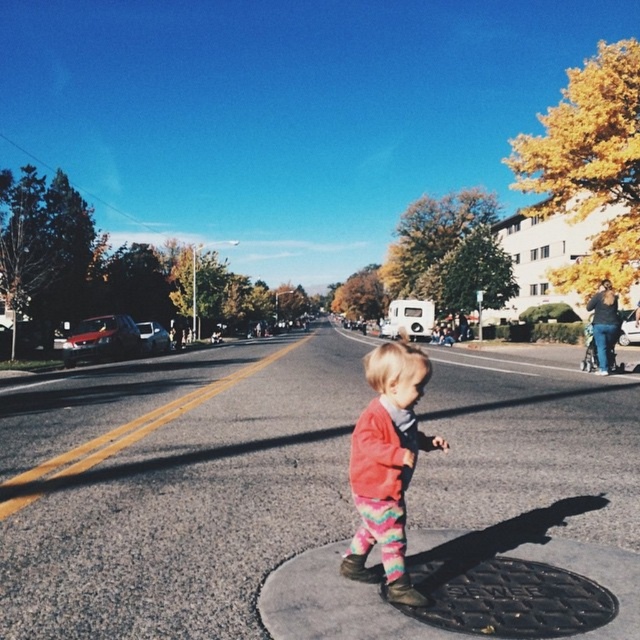
You are a pedestrian standing on the road and see the red sweater at center and the black textured manhole cover at center. Which object is closer to you?

The red sweater at center is closer because the black textured manhole cover at center is behind it.

You are a delivery person who needs to place a large package on the ground without covering the black textured manhole cover at center. The package is the same size as the red sweater at center. Will the package fit without overlapping the manhole cover?

The red sweater at center is larger in size than the black textured manhole cover at center. Since the package is the same size as the red sweater at center, it will also be larger than the manhole cover. Therefore, placing the package directly over the manhole cover would cause it to overlap, so you need to position it elsewhere to avoid covering the manhole cover.

You are standing at the point with coordinates point (x=397, y=561) and want to walk to the point with coordinates point (x=579, y=608). Given the street layout described in the scene, will you have to walk against the traffic flow or with it?

Since point (x=397, y=561) is behind point (x=579, y=608), you would be walking against the traffic flow towards the point (x=579, y=608). However, the scene does not explicitly mention traffic direction, so this is an assumption based on spatial positioning.